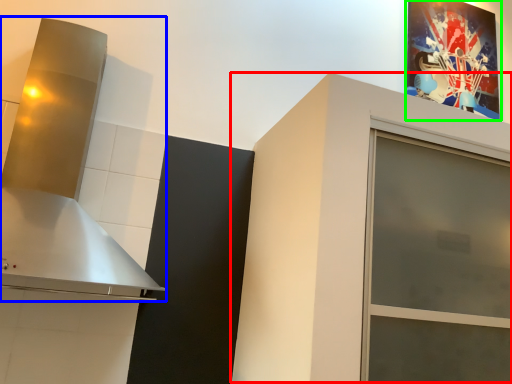
Question: Based on their relative distances, which object is farther from cabinetry (highlighted by a red box)? Choose from vent (highlighted by a blue box) and picture frame (highlighted by a green box).

Choices:
 (A) vent
 (B) picture frame

Answer: (B)